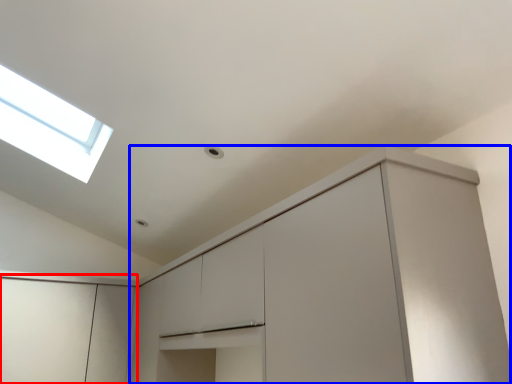
Question: Which object appears farthest to the camera in this image, cabinetry (highlighted by a red box) or cabinetry (highlighted by a blue box)?

Choices:
 (A) cabinetry
 (B) cabinetry

Answer: (A)